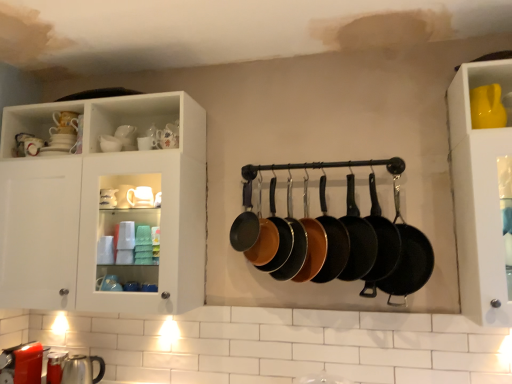
Question: Is matte black frying pan at center, the 6th frying pan viewed from the right, turned away from matte black frying pan at center, which is the third frying pan in left-to-right order?

Choices:
 (A) yes
 (B) no

Answer: (A)

Question: Would you consider matte black frying pan at center, which is the fourth frying pan in left-to-right order, to be distant from matte black frying pan at center, which is the third frying pan in left-to-right order?

Choices:
 (A) yes
 (B) no

Answer: (B)

Question: Does matte black frying pan at center, the 6th frying pan viewed from the right, appear on the left side of matte black frying pan at center, which is the third frying pan in left-to-right order?

Choices:
 (A) no
 (B) yes

Answer: (A)

Question: Considering the relative positions of matte black frying pan at center, which is the fourth frying pan in left-to-right order, and matte black frying pan at center, the seventh frying pan viewed from the right, in the image provided, is matte black frying pan at center, which is the fourth frying pan in left-to-right order, behind matte black frying pan at center, the seventh frying pan viewed from the right,?

Choices:
 (A) no
 (B) yes

Answer: (A)

Question: Is matte black frying pan at center, the 6th frying pan viewed from the right, closer to camera compared to matte black frying pan at center, which is the third frying pan in left-to-right order?

Choices:
 (A) no
 (B) yes

Answer: (B)

Question: Is matte black frying pan at center, the 6th frying pan viewed from the right, wider than matte black frying pan at center, the seventh frying pan viewed from the right?

Choices:
 (A) yes
 (B) no

Answer: (A)

Question: From a real-world perspective, is black cast iron frying pan at center, which is the 1th frying pan in right-to-left order, physically below metallic silver kettle at lower left, which is the 1th tableware from bottom to top?

Choices:
 (A) yes
 (B) no

Answer: (B)

Question: From a real-world perspective, is black cast iron frying pan at center, which is the 1th frying pan in right-to-left order, over metallic silver kettle at lower left, which ranks as the fourth tableware in top-to-bottom order?

Choices:
 (A) no
 (B) yes

Answer: (B)

Question: From the image's perspective, is black cast iron frying pan at center, placed as the ninth frying pan when sorted from left to right, under metallic silver kettle at lower left, which is the 1th tableware from bottom to top?

Choices:
 (A) yes
 (B) no

Answer: (B)

Question: Does black cast iron frying pan at center, placed as the ninth frying pan when sorted from left to right, appear on the right side of metallic silver kettle at lower left, the fourth tableware when ordered from right to left?

Choices:
 (A) no
 (B) yes

Answer: (B)

Question: From the image's perspective, is black cast iron frying pan at center, placed as the ninth frying pan when sorted from left to right, above metallic silver kettle at lower left, the third tableware when ordered from back to front?

Choices:
 (A) no
 (B) yes

Answer: (B)

Question: Can you confirm if black cast iron frying pan at center, placed as the ninth frying pan when sorted from left to right, is thinner than metallic silver kettle at lower left, the third tableware when ordered from back to front?

Choices:
 (A) yes
 (B) no

Answer: (A)

Question: Is matte black frying pan at center, which is the third frying pan in left-to-right order, further to the viewer compared to shiny black frying pan at center, the first frying pan positioned from the left?

Choices:
 (A) yes
 (B) no

Answer: (B)